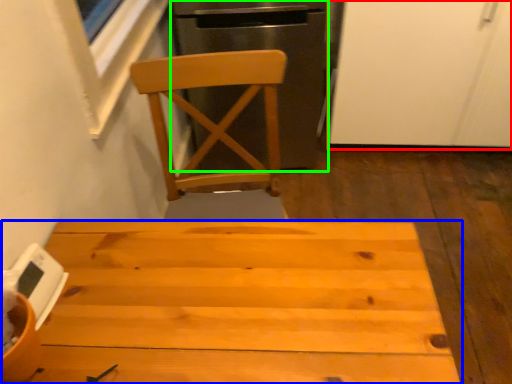
Question: Based on their relative distances, which object is farther from screen door (highlighted by a red box)? Choose from table (highlighted by a blue box) and leftover (highlighted by a green box).

Choices:
 (A) table
 (B) leftover

Answer: (A)